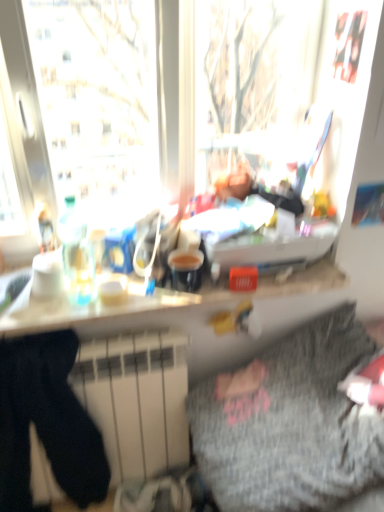
Question: Does white matte radiator at lower left have a greater height compared to black cotton sweat pants at lower left?

Choices:
 (A) no
 (B) yes

Answer: (A)

Question: Is white matte radiator at lower left touching black cotton sweat pants at lower left?

Choices:
 (A) no
 (B) yes

Answer: (A)

Question: Does white matte radiator at lower left appear on the left side of black cotton sweat pants at lower left?

Choices:
 (A) no
 (B) yes

Answer: (A)

Question: From a real-world perspective, is white matte radiator at lower left on top of black cotton sweat pants at lower left?

Choices:
 (A) yes
 (B) no

Answer: (B)

Question: Is white matte radiator at lower left bigger than black cotton sweat pants at lower left?

Choices:
 (A) no
 (B) yes

Answer: (B)

Question: Is white matte radiator at lower left inside or outside of white glossy counter top at center?

Choices:
 (A) inside
 (B) outside

Answer: (B)

Question: Based on their positions, is white matte radiator at lower left located to the left or right of white glossy counter top at center?

Choices:
 (A) left
 (B) right

Answer: (A)

Question: Is point (125, 385) positioned closer to the camera than point (152, 328)?

Choices:
 (A) farther
 (B) closer

Answer: (A)

Question: In terms of height, does white matte radiator at lower left look taller or shorter compared to white glossy counter top at center?

Choices:
 (A) tall
 (B) short

Answer: (A)

Question: Considering the relative positions of white matte radiator at lower left and gray textured blanket at lower right in the image provided, is white matte radiator at lower left to the left or to the right of gray textured blanket at lower right?

Choices:
 (A) left
 (B) right

Answer: (A)

Question: Considering the positions of white matte radiator at lower left and gray textured blanket at lower right in the image, is white matte radiator at lower left wider or thinner than gray textured blanket at lower right?

Choices:
 (A) thin
 (B) wide

Answer: (A)

Question: From a real-world perspective, is white matte radiator at lower left positioned above or below gray textured blanket at lower right?

Choices:
 (A) above
 (B) below

Answer: (B)

Question: In terms of height, does white matte radiator at lower left look taller or shorter compared to gray textured blanket at lower right?

Choices:
 (A) short
 (B) tall

Answer: (B)

Question: From a real-world perspective, is white matte radiator at lower left physically located above or below black cotton sweat pants at lower left?

Choices:
 (A) below
 (B) above

Answer: (A)

Question: Would you say white matte radiator at lower left is to the left or to the right of black cotton sweat pants at lower left in the picture?

Choices:
 (A) right
 (B) left

Answer: (A)